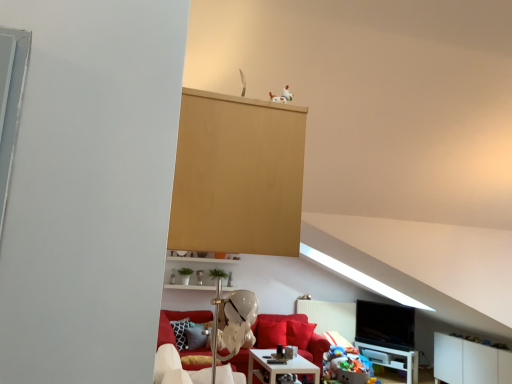
Identify the location of white glossy table at lower right, the 1th table positioned from the bottom. (392, 359).

Image resolution: width=512 pixels, height=384 pixels. What do you see at coordinates (176, 369) in the screenshot?
I see `white plastic swivel chair at lower center` at bounding box center [176, 369].

I want to click on light wood dresser at upper center, so click(x=237, y=175).

Are black glossy tv at lower right and white glossy table at lower right, acting as the second table starting from the front, making contact?

There is a gap between black glossy tv at lower right and white glossy table at lower right, acting as the second table starting from the front.

Which is in front, black glossy tv at lower right or white glossy table at lower right, acting as the second table starting from the front?

white glossy table at lower right, acting as the second table starting from the front, is in front.

From the image's perspective, does black glossy tv at lower right appear lower than white glossy table at lower right, which ranks as the first table in back-to-front order?

Incorrect, from the image's perspective, black glossy tv at lower right is higher than white glossy table at lower right, which ranks as the first table in back-to-front order.

There is a black glossy tv at lower right. Where is `the 2nd table below it (from the image's perspective)`? The width and height of the screenshot is (512, 384). the 2nd table below it (from the image's perspective) is located at coordinates (392, 359).

What's the angular difference between multicolored plush toys at lower right and velvet red couch at center's facing directions?

The angle between the facing direction of multicolored plush toys at lower right and the facing direction of velvet red couch at center is 70.5 degrees.

Could you tell me if multicolored plush toys at lower right is facing velvet red couch at center?

No, multicolored plush toys at lower right is not oriented towards velvet red couch at center.

Does multicolored plush toys at lower right have a greater width compared to velvet red couch at center?

No.

Considering the sizes of objects multicolored plush toys at lower right and velvet red couch at center in the image provided, who is smaller, multicolored plush toys at lower right or velvet red couch at center?

With smaller size is multicolored plush toys at lower right.

Is velvet red couch at center to the right of light wood dresser at upper center from the viewer's perspective?

Indeed, velvet red couch at center is positioned on the right side of light wood dresser at upper center.

Which object is further away from the camera taking this photo, velvet red couch at center or light wood dresser at upper center?

velvet red couch at center.

Between velvet red couch at center and light wood dresser at upper center, which one has more height?

Standing taller between the two is velvet red couch at center.

Is white glossy table at lower center, the first table in the top-to-bottom sequence, to the left of velvet red couch at center from the viewer's perspective?

No.

Is velvet red couch at center inside white glossy table at lower center, the first table in the top-to-bottom sequence?

Definitely not — velvet red couch at center is not inside white glossy table at lower center, the first table in the top-to-bottom sequence.

Would you consider white glossy table at lower center, the second table viewed from the back, to be distant from velvet red couch at center?

No, white glossy table at lower center, the second table viewed from the back, is in close proximity to velvet red couch at center.

Could you tell me if white glossy table at lower center, the first table from the front, is facing velvet red couch at center?

No, white glossy table at lower center, the first table from the front, is not facing towards velvet red couch at center.

From a real-world perspective, is white glossy table at lower right, the 1th table positioned from the bottom, positioned over white glossy table at lower center, the second table in the right-to-left sequence, based on gravity?

No, from a real-world perspective, white glossy table at lower right, the 1th table positioned from the bottom, is not on top of white glossy table at lower center, the second table in the right-to-left sequence.

Does white glossy table at lower right, which ranks as the first table in back-to-front order, have a smaller size compared to white glossy table at lower center, the second table in the right-to-left sequence?

Indeed, white glossy table at lower right, which ranks as the first table in back-to-front order, has a smaller size compared to white glossy table at lower center, the second table in the right-to-left sequence.

Between white glossy table at lower right, acting as the second table starting from the front, and white glossy table at lower center, the first table in the top-to-bottom sequence, which one appears on the left side from the viewer's perspective?

white glossy table at lower center, the first table in the top-to-bottom sequence, is more to the left.

Locate an element on the screen. This screenshot has height=384, width=512. table that is under the white glossy table at lower center, the second table viewed from the back (from a real-world perspective) is located at coordinates tap(392, 359).

From a real-world perspective, is white glossy shelf at lower center over white glossy table at lower center, the second table when ordered from bottom to top?

Correct, in the physical world, white glossy shelf at lower center is higher than white glossy table at lower center, the second table when ordered from bottom to top.

Which object is further away from the camera, white glossy shelf at lower center or white glossy table at lower center, the first table from the front?

white glossy shelf at lower center is behind.

From the image's perspective, is white glossy shelf at lower center under white glossy table at lower center, the second table in the right-to-left sequence?

Incorrect, from the image's perspective, white glossy shelf at lower center is higher than white glossy table at lower center, the second table in the right-to-left sequence.

In the scene shown: Is white glossy table at lower center, marked as the first table in a left-to-right arrangement, at the back of white glossy shelf at lower center?

That's not correct — white glossy shelf at lower center is not looking away from white glossy table at lower center, marked as the first table in a left-to-right arrangement.

Is white glossy table at lower center, the second table in the right-to-left sequence, taller or shorter than white plastic swivel chair at lower center?

Considering their sizes, white glossy table at lower center, the second table in the right-to-left sequence, has more height than white plastic swivel chair at lower center.

Between point (275, 378) and point (178, 380), which one is positioned in front?

Point (178, 380)

Could you tell me if white glossy table at lower center, the first table from the front, is turned towards white plastic swivel chair at lower center?

No, white glossy table at lower center, the first table from the front, is not facing towards white plastic swivel chair at lower center.

Find the location of `entertainment center that appears behind the white glossy table at lower right, the 1th table positioned from the bottom`. entertainment center that appears behind the white glossy table at lower right, the 1th table positioned from the bottom is located at coordinates (387, 336).

This screenshot has height=384, width=512. Find the location of `studio couch above the multicolored plush toys at lower right (from the image's perspective)`. studio couch above the multicolored plush toys at lower right (from the image's perspective) is located at coordinates (178, 319).

Considering their positions, is black glossy tv at lower right positioned closer to white matte cabinet at lower right than white glossy table at lower right, which ranks as the first table in back-to-front order?

white glossy table at lower right, which ranks as the first table in back-to-front order, is closer to white matte cabinet at lower right.

Considering their positions, is multicolored plush toys at lower right positioned further to white glossy shelf at lower center than velvet red couch at center?

Based on the image, multicolored plush toys at lower right appears to be further to white glossy shelf at lower center.

Estimate the real-world distances between objects in this image. Which object is closer to white matte dog at upper center, multicolored plush toys at lower right or white glossy table at lower right, acting as the second table starting from the front?

multicolored plush toys at lower right lies closer to white matte dog at upper center than the other object.

Consider the image. Which object lies further to the anchor point light wood dresser at upper center, black glossy tv at lower right or white matte cabinet at lower right?

Among the two, white matte cabinet at lower right is located further to light wood dresser at upper center.

Estimate the real-world distances between objects in this image. Which object is closer to black glossy tv at lower right, multicolored plush toys at lower right or velvet red couch at center?

The object closer to black glossy tv at lower right is multicolored plush toys at lower right.

Considering their positions, is black glossy tv at lower right positioned further to white matte dog at upper center than white glossy shelf at lower center?

Among the two, black glossy tv at lower right is located further to white matte dog at upper center.

Based on the photo, based on their spatial positions, is multicolored plush toys at lower right or white plastic swivel chair at lower center closer to white glossy table at lower right, the 1th table positioned from the bottom?

multicolored plush toys at lower right.

When comparing their distances from white glossy table at lower right, the 1th table positioned from the bottom, does multicolored plush toys at lower right or white matte dog at upper center seem closer?

Among the two, multicolored plush toys at lower right is located nearer to white glossy table at lower right, the 1th table positioned from the bottom.

You are a GUI agent. You are given a task and a screenshot of the screen. Output one action in this format:
    pyautogui.click(x=<x>, y=<y>)
    Task: Click on the stuff between velvet red couch at center and white matte cabinet at lower right
    This screenshot has height=384, width=512.
    Given the screenshot: What is the action you would take?
    pos(346,365)

Find the location of `stuff between white glossy shelf at lower center and black glossy tv at lower right`. stuff between white glossy shelf at lower center and black glossy tv at lower right is located at coordinates (346, 365).

This screenshot has width=512, height=384. In order to click on studio couch located between light wood dresser at upper center and white glossy shelf at lower center in the depth direction in this screenshot , I will do `click(178, 319)`.

Where is `table located between white matte dog at upper center and velvet red couch at center in the depth direction`? The image size is (512, 384). table located between white matte dog at upper center and velvet red couch at center in the depth direction is located at coordinates (281, 366).